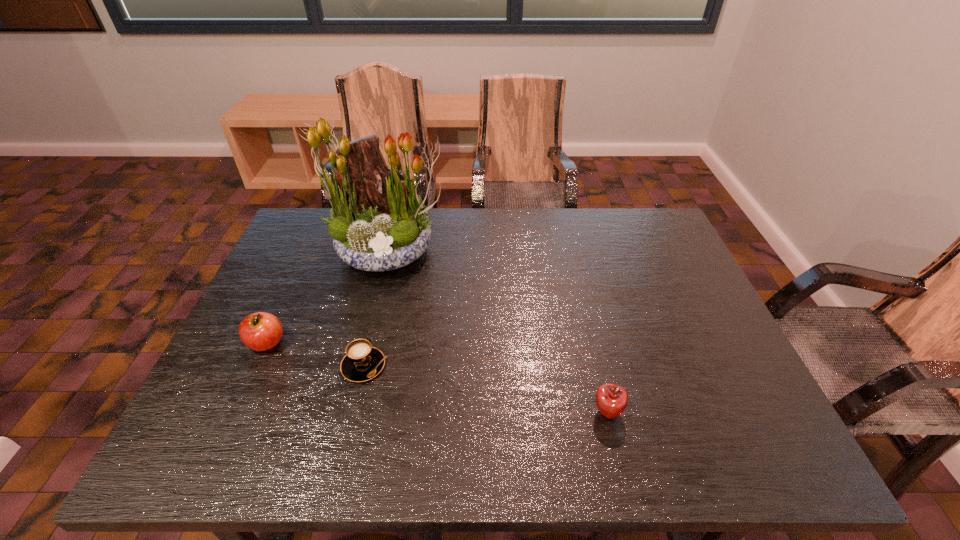
The width and height of the screenshot is (960, 540). I want to click on vacant space located 0.330m on the right of the shortest object, so click(528, 366).

You are a GUI agent. You are given a task and a screenshot of the screen. Output one action in this format:
    pyautogui.click(x=<x>, y=<y>)
    Task: Click on the object situated at the far edge
    The image size is (960, 540).
    Given the screenshot: What is the action you would take?
    pyautogui.click(x=372, y=229)

Where is `object situated at the near edge`? The image size is (960, 540). object situated at the near edge is located at coordinates (611, 400).

You are a GUI agent. You are given a task and a screenshot of the screen. Output one action in this format:
    pyautogui.click(x=<x>, y=<y>)
    Task: Click on the flower arrangement that is at the left edge
    The width and height of the screenshot is (960, 540).
    Given the screenshot: What is the action you would take?
    pyautogui.click(x=372, y=229)

This screenshot has height=540, width=960. Find the location of `apple that is at the left edge`. apple that is at the left edge is located at coordinates (261, 331).

In order to click on object at the far left corner in this screenshot , I will do `click(372, 229)`.

Identify the location of free space at the far edge of the desktop. The width and height of the screenshot is (960, 540). (590, 234).

In the image, there is a desktop. Where is `vacant area at the near edge`? vacant area at the near edge is located at coordinates (587, 441).

The height and width of the screenshot is (540, 960). I want to click on vacant space at the left edge of the desktop, so click(274, 376).

Where is `vacant space at the right edge`? Image resolution: width=960 pixels, height=540 pixels. vacant space at the right edge is located at coordinates (681, 289).